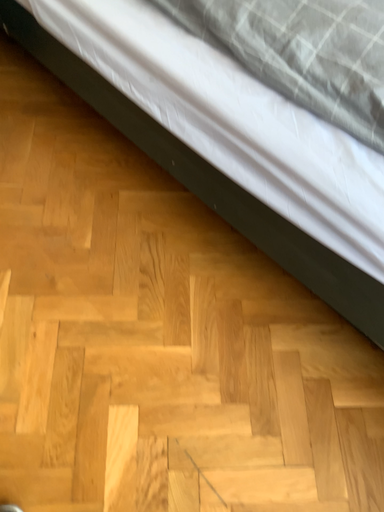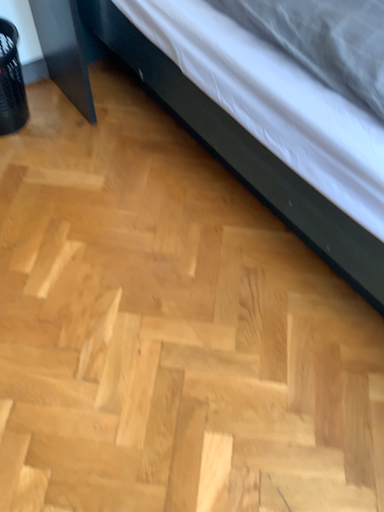
Question: Which way did the camera rotate in the video?

Choices:
 (A) rotated downward
 (B) rotated upward

Answer: (B)